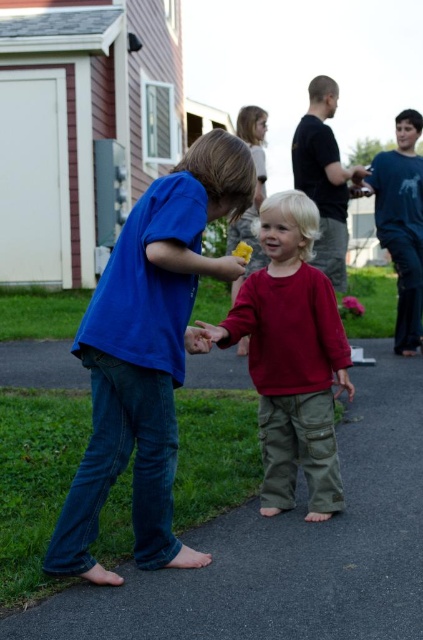
Question: Is black asphalt pavement at center further to camera compared to matte red shirt at center?

Choices:
 (A) no
 (B) yes

Answer: (A)

Question: From the image, what is the correct spatial relationship of black asphalt pavement at center in relation to blue t-shirt at right?

Choices:
 (A) above
 (B) below

Answer: (B)

Question: Is matte red shirt at center positioned at the back of blue t-shirt at right?

Choices:
 (A) yes
 (B) no

Answer: (B)

Question: Which point is closer to the camera taking this photo?

Choices:
 (A) (150, 310)
 (B) (269, 234)

Answer: (A)

Question: Estimate the real-world distances between objects in this image. Which object is farther from the matte red shirt at center?

Choices:
 (A) black asphalt pavement at center
 (B) blue t-shirt at right

Answer: (B)

Question: Which object is positioned farthest from the black asphalt pavement at center?

Choices:
 (A) matte red shirt at center
 (B) blue t-shirt at right
 (C) blue cotton shirt at center

Answer: (B)